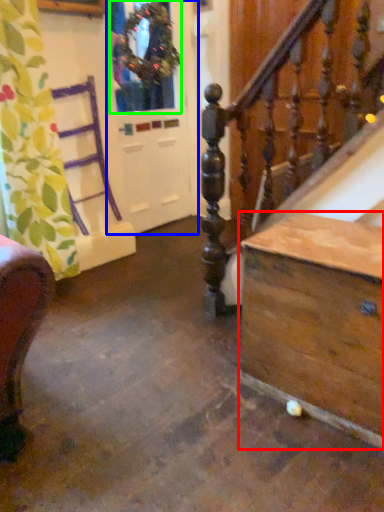
Question: Which is farther away from table (highlighted by a red box)? screen door (highlighted by a blue box) or window (highlighted by a green box)?

Choices:
 (A) screen door
 (B) window

Answer: (B)